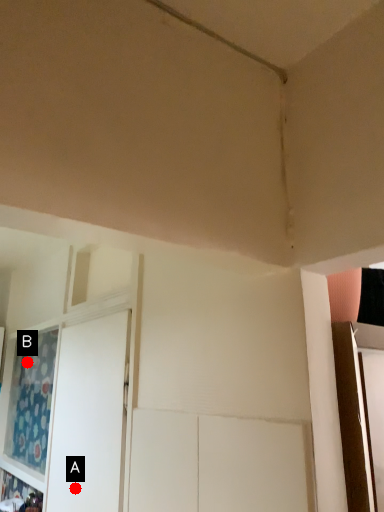
Question: Two points are circled on the image, labeled by A and B beside each circle. Which point is farther to the camera?

Choices:
 (A) A is further
 (B) B is further

Answer: (B)